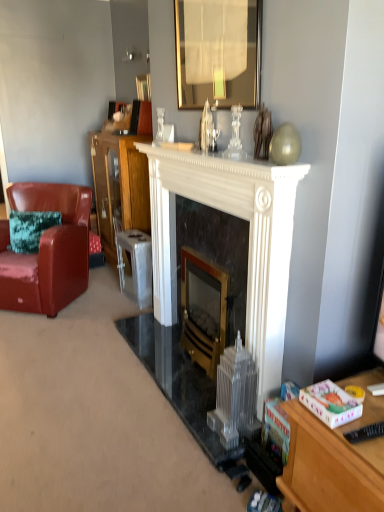
Where is `free space above black marble fireplace at center, the second fireplace from the left (from a real-world perspective)`? free space above black marble fireplace at center, the second fireplace from the left (from a real-world perspective) is located at coordinates (205, 203).